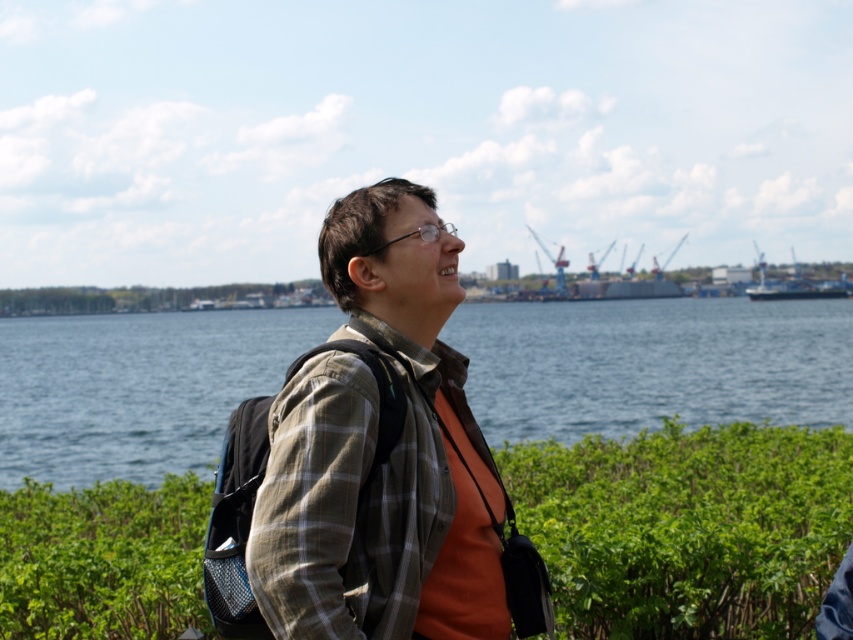
Question: Which point is closer to the camera taking this photo?

Choices:
 (A) (473, 410)
 (B) (757, 292)
 (C) (791, 637)
 (D) (422, 474)

Answer: (D)

Question: Is blue water at center above plaid fabric shirt at center?

Choices:
 (A) yes
 (B) no

Answer: (A)

Question: Which is farther from the plaid fabric shirt at center?

Choices:
 (A) blue water at center
 (B) blue metallic ship at right

Answer: (B)

Question: Which point is farther to the camera?

Choices:
 (A) (727, 352)
 (B) (671, 589)
 (C) (463, 522)

Answer: (A)

Question: Can you confirm if green leafy shrubs at center is smaller than blue metallic ship at right?

Choices:
 (A) yes
 (B) no

Answer: (A)

Question: Is green leafy shrubs at center further to camera compared to plaid fabric shirt at center?

Choices:
 (A) yes
 (B) no

Answer: (A)